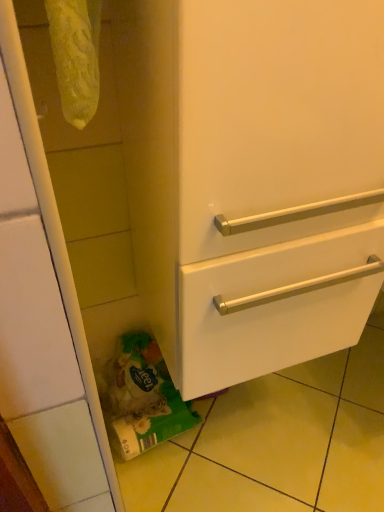
Question: Can you confirm if green matte plastic bag at lower left is thinner than white glossy drawer at lower right?

Choices:
 (A) yes
 (B) no

Answer: (A)

Question: Is the position of green matte plastic bag at lower left less distant than that of white glossy drawer at lower right?

Choices:
 (A) no
 (B) yes

Answer: (A)

Question: Is the surface of green matte plastic bag at lower left in direct contact with white glossy drawer at lower right?

Choices:
 (A) no
 (B) yes

Answer: (A)

Question: Would you say green matte plastic bag at lower left is outside white glossy drawer at lower right?

Choices:
 (A) no
 (B) yes

Answer: (B)

Question: Is white glossy drawer at lower right inside green matte plastic bag at lower left?

Choices:
 (A) no
 (B) yes

Answer: (A)

Question: Does green matte plastic bag at lower left appear on the right side of white glossy drawer at lower right?

Choices:
 (A) yes
 (B) no

Answer: (B)

Question: Is the depth of white glossy drawer at lower right less than that of green matte plastic bag at lower left?

Choices:
 (A) yes
 (B) no

Answer: (A)

Question: Is white glossy drawer at lower right facing away from green matte plastic bag at lower left?

Choices:
 (A) no
 (B) yes

Answer: (A)

Question: Is white glossy drawer at lower right outside of green matte plastic bag at lower left?

Choices:
 (A) no
 (B) yes

Answer: (B)

Question: Is white glossy drawer at lower right next to green matte plastic bag at lower left and touching it?

Choices:
 (A) no
 (B) yes

Answer: (A)

Question: Considering the relative positions of white glossy drawer at lower right and green matte plastic bag at lower left in the image provided, is white glossy drawer at lower right to the right of green matte plastic bag at lower left from the viewer's perspective?

Choices:
 (A) no
 (B) yes

Answer: (B)

Question: From a real-world perspective, does white glossy drawer at lower right stand above green matte plastic bag at lower left?

Choices:
 (A) yes
 (B) no

Answer: (A)

Question: Considering the positions of green matte plastic bag at lower left and white glossy drawer at lower right in the image, is green matte plastic bag at lower left bigger or smaller than white glossy drawer at lower right?

Choices:
 (A) small
 (B) big

Answer: (A)